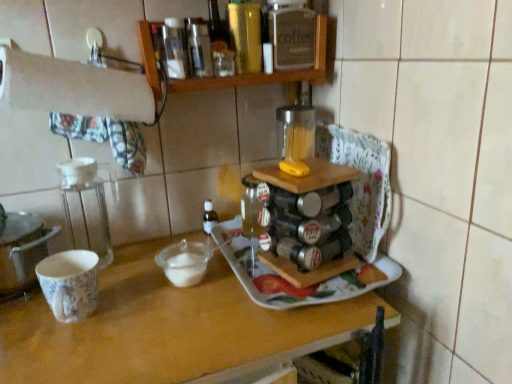
Where is `vacant space to the right of transparent glass mixing bowl at center`? This screenshot has height=384, width=512. vacant space to the right of transparent glass mixing bowl at center is located at coordinates (251, 284).